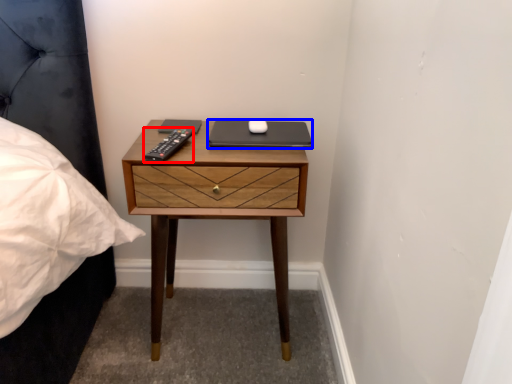
Question: Among these objects, which one is farthest to the camera, remote (highlighted by a red box) or laptop (highlighted by a blue box)?

Choices:
 (A) remote
 (B) laptop

Answer: (B)